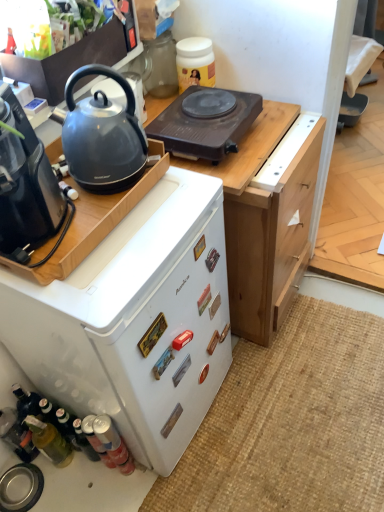
Identify the location of empty space that is ontop of brown plastic electric hot plate at upper center (from a real-world perspective). (207, 105).